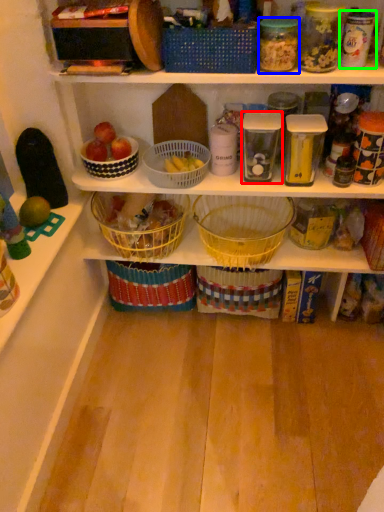
Question: Based on their relative distances, which object is farther from glass jar (highlighted by a red box)? Choose from glass jar (highlighted by a blue box) and glass jar (highlighted by a green box).

Choices:
 (A) glass jar
 (B) glass jar

Answer: (B)